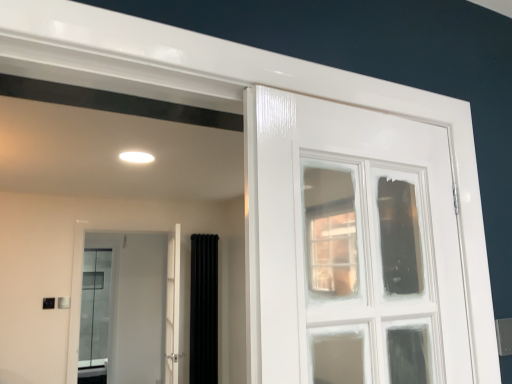
Question: Is black velvet curtain at center to the right of white glossy door at center from the viewer's perspective?

Choices:
 (A) no
 (B) yes

Answer: (B)

Question: Are black velvet curtain at center and white glossy door at center located far from each other?

Choices:
 (A) yes
 (B) no

Answer: (B)

Question: Is black velvet curtain at center aimed at white glossy door at center?

Choices:
 (A) yes
 (B) no

Answer: (B)

Question: From a real-world perspective, is black velvet curtain at center beneath white glossy door at center?

Choices:
 (A) no
 (B) yes

Answer: (B)

Question: Considering the relative sizes of black velvet curtain at center and white glossy door at center in the image provided, is black velvet curtain at center shorter than white glossy door at center?

Choices:
 (A) yes
 (B) no

Answer: (B)

Question: From the image's perspective, is white glossy door at center positioned above or below black velvet curtain at center?

Choices:
 (A) above
 (B) below

Answer: (A)

Question: Considering the positions of white glossy door at center and black velvet curtain at center in the image, is white glossy door at center bigger or smaller than black velvet curtain at center?

Choices:
 (A) small
 (B) big

Answer: (B)

Question: From a real-world perspective, is white glossy door at center above or below black velvet curtain at center?

Choices:
 (A) below
 (B) above

Answer: (B)

Question: In the image, is white glossy door at center on the left side or the right side of black velvet curtain at center?

Choices:
 (A) right
 (B) left

Answer: (B)

Question: In the image, is black velvet curtain at center positioned in front of or behind white glossy door at center?

Choices:
 (A) front
 (B) behind

Answer: (B)

Question: Based on their sizes in the image, would you say black velvet curtain at center is bigger or smaller than white glossy door at center?

Choices:
 (A) small
 (B) big

Answer: (A)

Question: From the image's perspective, is black velvet curtain at center located above or below white glossy door at center?

Choices:
 (A) below
 (B) above

Answer: (A)

Question: Which is correct: black velvet curtain at center is inside white glossy door at center, or outside of it?

Choices:
 (A) outside
 (B) inside

Answer: (A)

Question: In the image, is white glossy door at center on the left side or the right side of white glossy door at center?

Choices:
 (A) left
 (B) right

Answer: (A)

Question: Based on their sizes in the image, would you say white glossy door at center is bigger or smaller than white glossy door at center?

Choices:
 (A) big
 (B) small

Answer: (B)